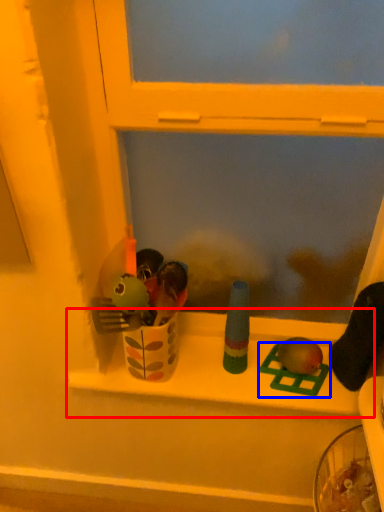
Question: Which object is closer to the camera taking this photo, window sill (highlighted by a red box) or toy (highlighted by a blue box)?

Choices:
 (A) window sill
 (B) toy

Answer: (A)